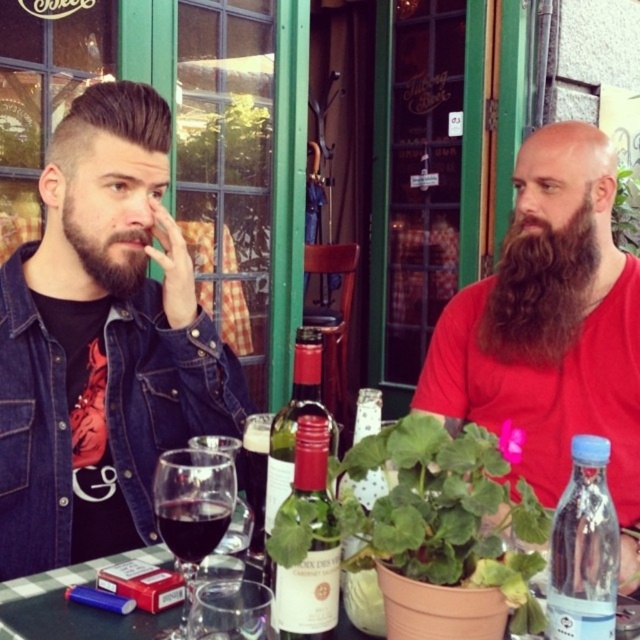
You are a photographer standing in front of the scene. You want to take a photo that focuses on the white matte wine bottle at center without including the dark brown thick beard at left. Based on their positions, is this possible?

The white matte wine bottle at center is closer to the viewer than the dark brown thick beard at left, so yes, it is possible to focus on the white matte wine bottle at center without including the dark brown thick beard at left by adjusting the camera angle or zoom.

You are a photographer standing at the scene. You want to take a photo of the two people seated at the table without the clear plastic bottle at lower right appearing in the frame. Is it possible to do so by moving closer to the subjects?

The clear plastic bottle at lower right is 25.16 inches away from the camera. Moving closer to the subjects might bring the bottle into the frame or make it larger, so it is not possible to avoid it by moving closer.

You are a photographer standing at the edge of the outdoor table scene. You want to place a new object exactly where the white matte wine bottle at center is currently located. What coordinates should you use for placement?

The white matte wine bottle at center is located at coordinates point (x=364, y=602), so you should place the new object at those coordinates.